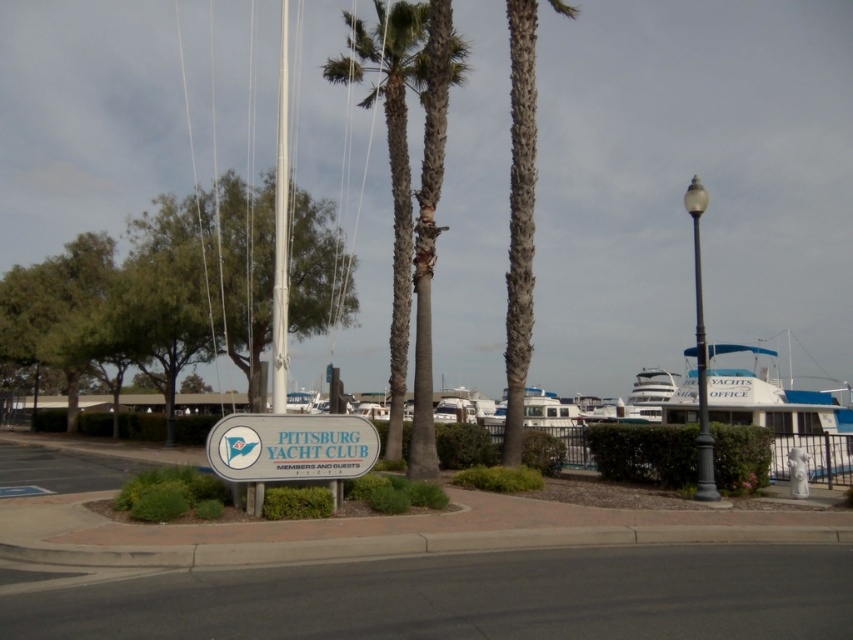
Between gray textured palm tree at center and white plastic sign at center, which one appears on the left side from the viewer's perspective?

Positioned to the left is white plastic sign at center.

Can you confirm if gray textured palm tree at center is positioned below white plastic sign at center?

No.

Describe the element at coordinates (430, 220) in the screenshot. I see `gray textured palm tree at center` at that location.

You are a GUI agent. You are given a task and a screenshot of the screen. Output one action in this format:
    pyautogui.click(x=<x>, y=<y>)
    Task: Click on the gray textured palm tree at center
    This screenshot has height=640, width=853.
    Given the screenshot: What is the action you would take?
    pyautogui.click(x=430, y=220)

Who is more distant from viewer, (340, 461) or (527, 424)?

Point (527, 424)

At what (x,y) coordinates should I click in order to perform the action: click on white plastic sign at center. Please return your answer as a coordinate pair (x, y). This screenshot has height=640, width=853. Looking at the image, I should click on (289, 445).

Between point (331, 465) and point (546, 419), which one is positioned behind?

The point (546, 419) is more distant.

What are the coordinates of `white plastic sign at center` in the screenshot? It's located at (289, 445).

Is green leafy tree at left closer to camera compared to white plastic sign at center?

No, green leafy tree at left is behind white plastic sign at center.

Can you confirm if green leafy tree at left is taller than white plastic sign at center?

Yes.

Who is more forward, (161,228) or (287,417)?

Positioned in front is point (287,417).

Where is `green leafy tree at left`? green leafy tree at left is located at coordinates (149, 292).